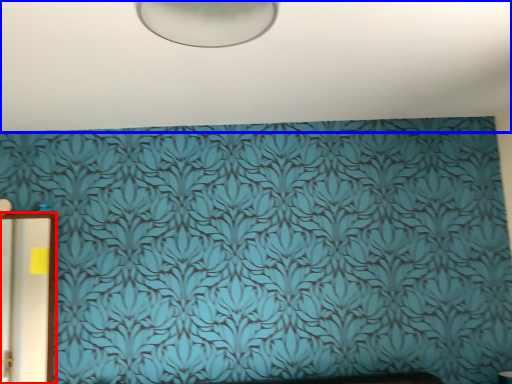
Question: Which point is closer to the camera, door (highlighted by a red box) or backdrop (highlighted by a blue box)?

Choices:
 (A) door
 (B) backdrop

Answer: (B)